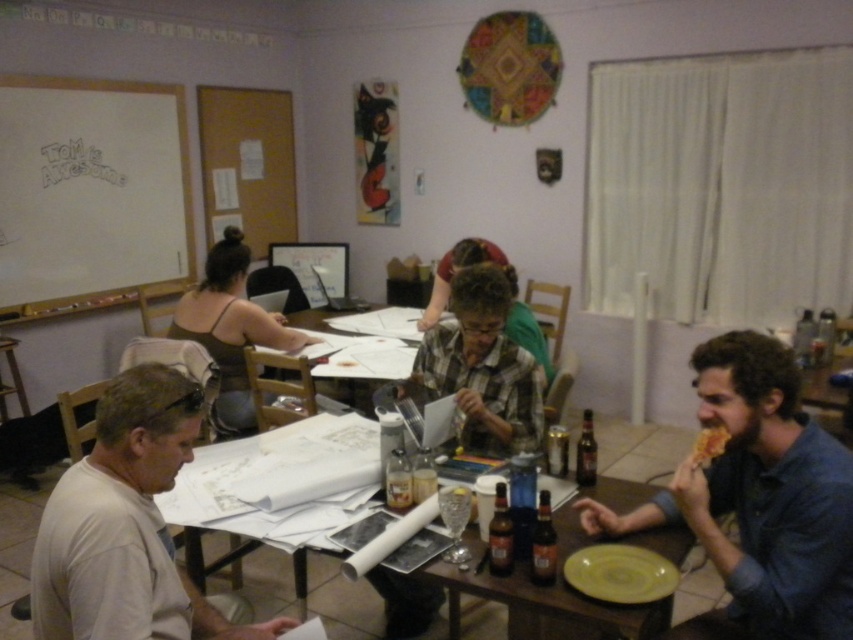
Does wooden table at center appear under brown glass bottle at lower center?

Correct, wooden table at center is located below brown glass bottle at lower center.

Who is higher up, wooden table at center or brown glass bottle at lower center?

brown glass bottle at lower center is higher up.

Which is behind, point (212, 445) or point (502, 573)?

The point (212, 445) is behind.

Identify the location of wooden table at center. (640, 449).

Does point (177, 444) come in front of point (582, 477)?

Yes, it is in front of point (582, 477).

Between white matte shirt at lower left and brown glass bottle at table right, which one is positioned lower?

brown glass bottle at table right

Image resolution: width=853 pixels, height=640 pixels. In order to click on white matte shirt at lower left in this screenshot , I will do `click(126, 525)`.

What are the coordinates of `white matte shirt at lower left` in the screenshot? It's located at (126, 525).

Is white matte shirt at lower left positioned at the back of golden crispy pizza slice at lower right?

No, it is in front of golden crispy pizza slice at lower right.

I want to click on white matte shirt at lower left, so click(126, 525).